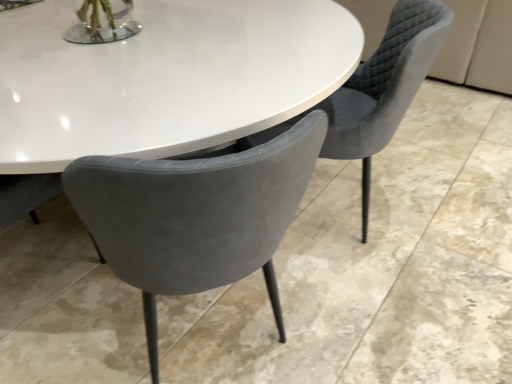
Where is `unoccupied region to the right of matte gray chair at center, which is the second chair from right to left`? The height and width of the screenshot is (384, 512). unoccupied region to the right of matte gray chair at center, which is the second chair from right to left is located at coordinates (382, 316).